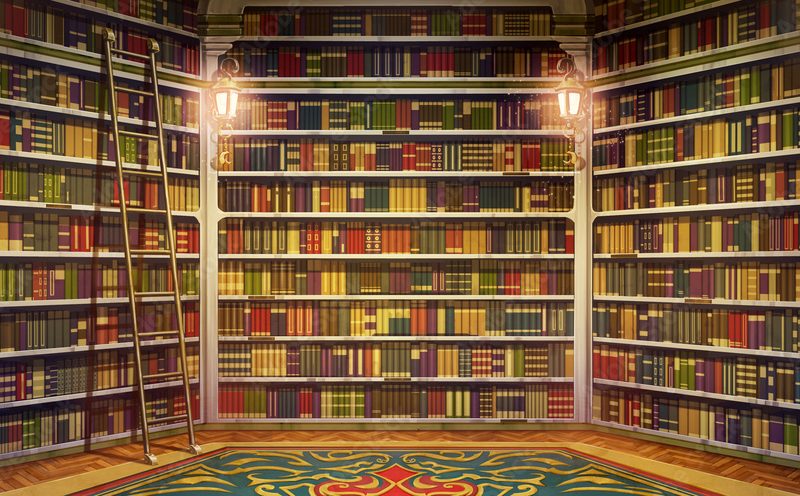
You are a GUI agent. You are given a task and a screenshot of the screen. Output one action in this format:
    pyautogui.click(x=<x>, y=<y>)
    Task: Click on the rungs on ladder
    This screenshot has width=800, height=496.
    Given the screenshot: What is the action you would take?
    point(138,54), point(134,90), point(138,132), point(142,168), point(146,208), point(157,250), point(160,291), point(168,340), point(170,375), point(174,416)